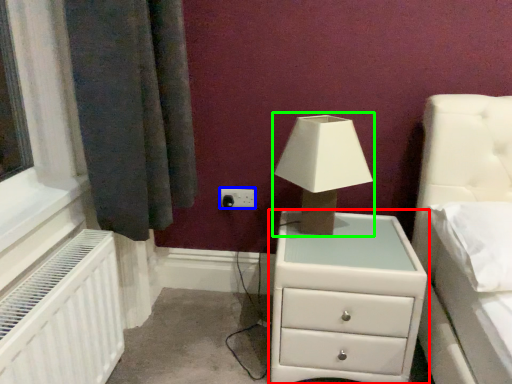
Question: Considering the real-world distances, which object is farthest from chest of drawers (highlighted by a red box)? electric outlet (highlighted by a blue box) or table lamp (highlighted by a green box)?

Choices:
 (A) electric outlet
 (B) table lamp

Answer: (A)